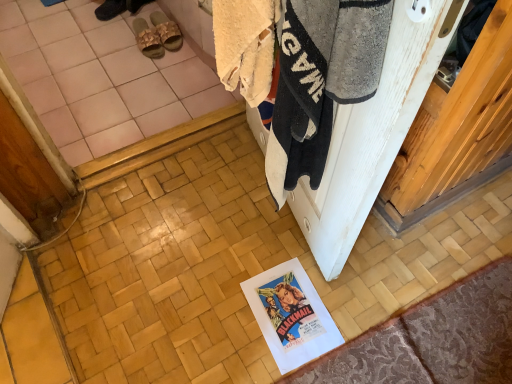
This screenshot has width=512, height=384. In order to click on free location in front of dark brown leather sandals at upper center, which is the 1th footwear in left-to-right order in this screenshot , I will do 106,30.